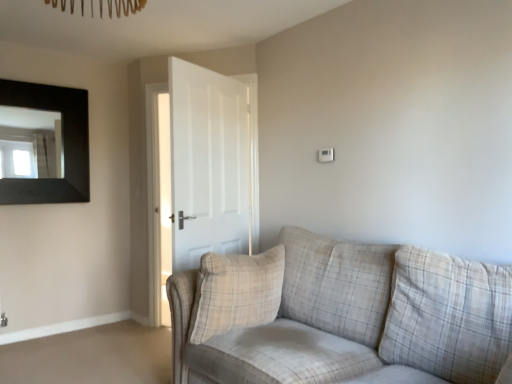
Question: From a real-world perspective, is beige plaid pillow at center positioned under black matte picture frame at upper left based on gravity?

Choices:
 (A) no
 (B) yes

Answer: (B)

Question: Considering the relative positions of beige plaid pillow at center and black matte picture frame at upper left in the image provided, is beige plaid pillow at center to the right of black matte picture frame at upper left from the viewer's perspective?

Choices:
 (A) no
 (B) yes

Answer: (B)

Question: Would you say beige plaid pillow at center is a long distance from black matte picture frame at upper left?

Choices:
 (A) no
 (B) yes

Answer: (B)

Question: From the image's perspective, is beige plaid pillow at center on top of black matte picture frame at upper left?

Choices:
 (A) no
 (B) yes

Answer: (A)

Question: Is beige plaid pillow at center placed right next to black matte picture frame at upper left?

Choices:
 (A) yes
 (B) no

Answer: (B)

Question: Is beige plaid pillow at center wider than black matte picture frame at upper left?

Choices:
 (A) yes
 (B) no

Answer: (A)

Question: Does plaid fabric couch at center come in front of beige plaid pillow at center?

Choices:
 (A) yes
 (B) no

Answer: (A)

Question: Is plaid fabric couch at center aimed at beige plaid pillow at center?

Choices:
 (A) no
 (B) yes

Answer: (B)

Question: Are plaid fabric couch at center and beige plaid pillow at center beside each other?

Choices:
 (A) yes
 (B) no

Answer: (B)

Question: From a real-world perspective, is plaid fabric couch at center positioned over beige plaid pillow at center based on gravity?

Choices:
 (A) yes
 (B) no

Answer: (B)

Question: Is plaid fabric couch at center bigger than beige plaid pillow at center?

Choices:
 (A) yes
 (B) no

Answer: (A)

Question: From the image's perspective, is plaid fabric couch at center below beige plaid pillow at center?

Choices:
 (A) yes
 (B) no

Answer: (A)

Question: From a real-world perspective, does white matte door at center stand above black matte picture frame at upper left?

Choices:
 (A) yes
 (B) no

Answer: (B)